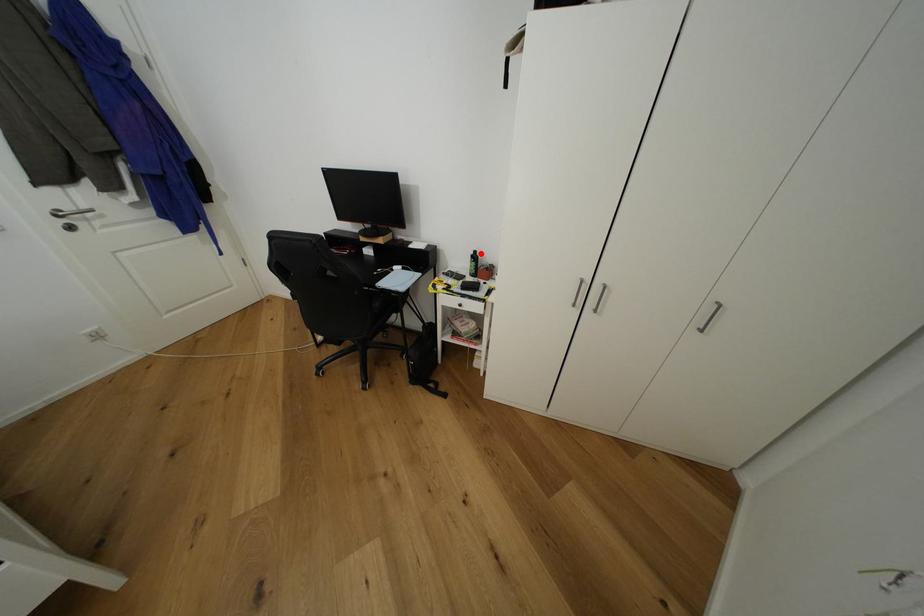
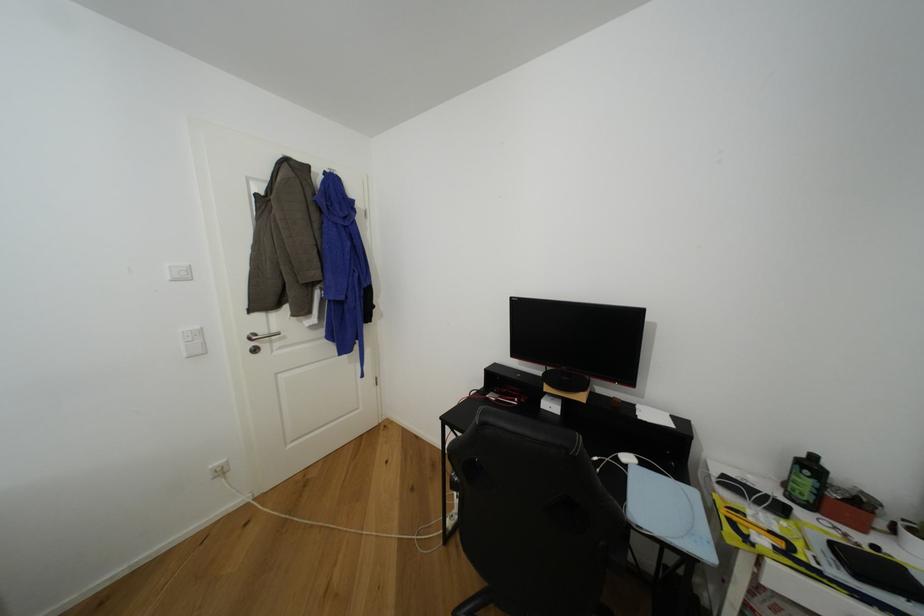
Where in the second image is the point corresponding to the highlighted location from the first image?

(820, 459)